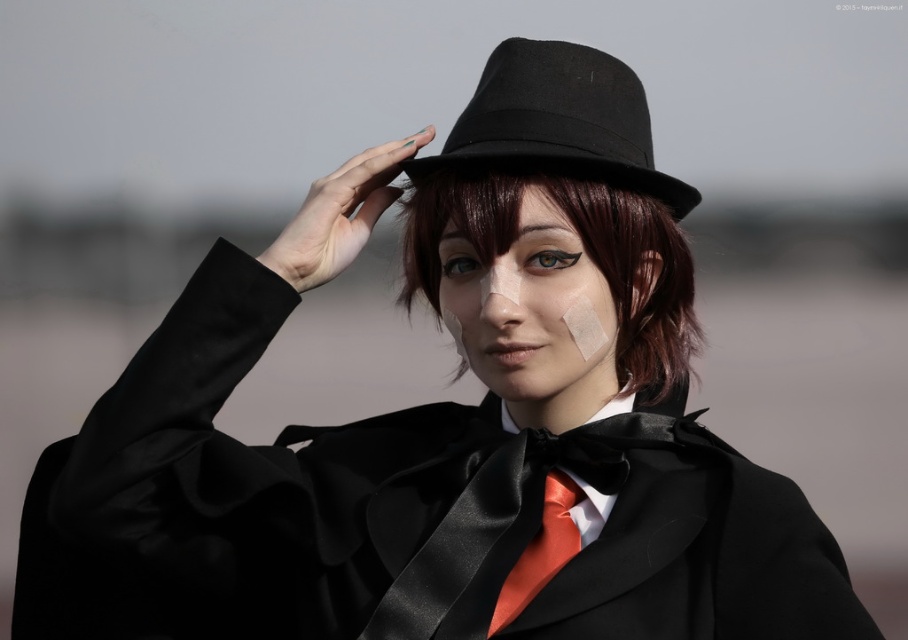
Can you confirm if black felt fedora at center is positioned below satin orange tie at center?

No, black felt fedora at center is not below satin orange tie at center.

Is point (594, 84) positioned before point (569, 483)?

No, (594, 84) is further to viewer.

The height and width of the screenshot is (640, 908). In order to click on black felt fedora at center in this screenshot , I will do coord(558,122).

Does point (422, 225) lie in front of point (561, 515)?

No, (422, 225) is behind (561, 515).

Between dark brown silky hair at center and satin orange tie at center, which one is positioned lower?

Positioned lower is satin orange tie at center.

Find the location of a particular element. dark brown silky hair at center is located at coordinates (587, 253).

Does dark brown silky hair at center come behind black felt fedora at center?

Yes.

Between dark brown silky hair at center and black felt fedora at center, which one has less height?

Standing shorter between the two is black felt fedora at center.

Find the location of a particular element. dark brown silky hair at center is located at coordinates (587, 253).